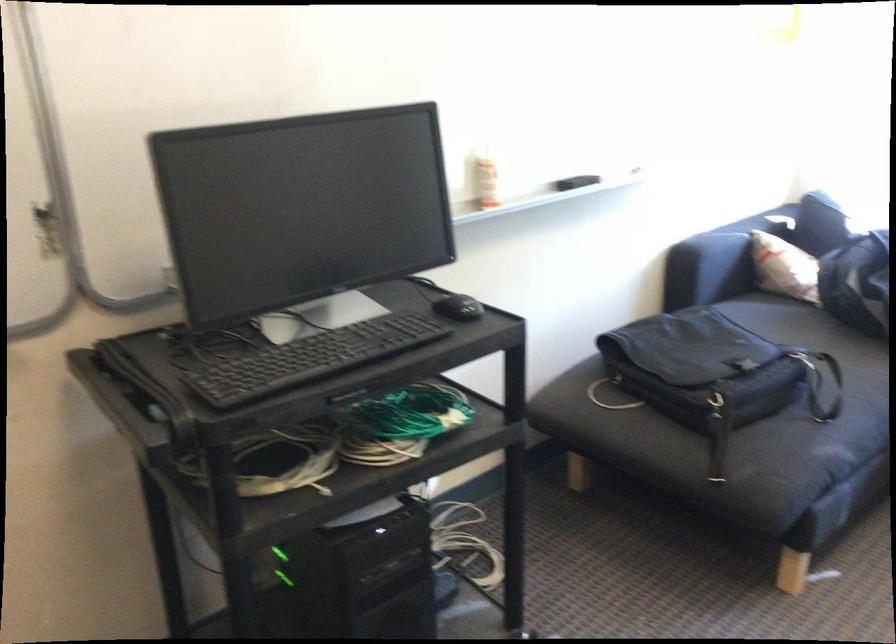
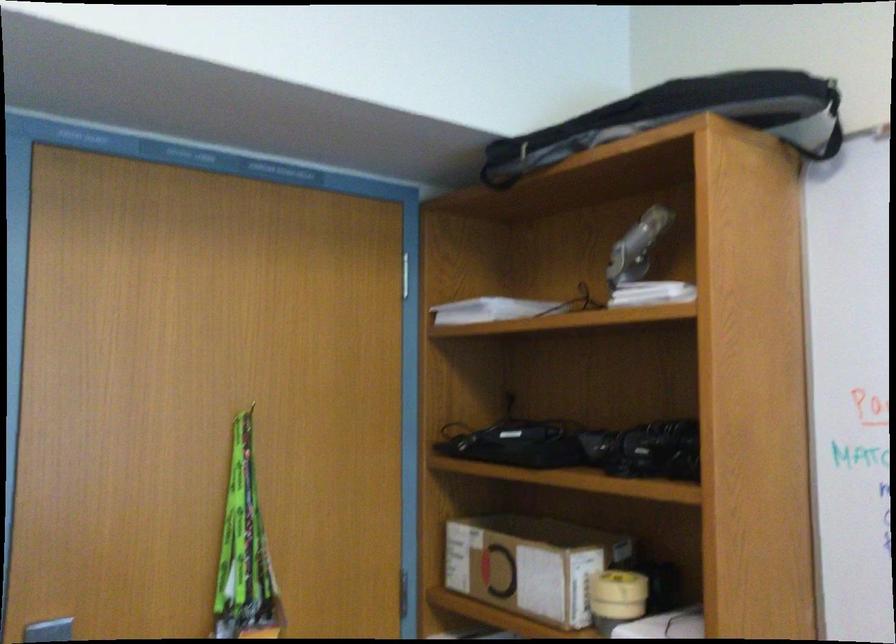
Question: The camera is either moving clockwise (left) or counter-clockwise (right) around the object. The first image is from the beginning of the video and the second image is from the end. Is the camera moving left or right when shooting the video?

Choices:
 (A) Left
 (B) Right

Answer: (B)